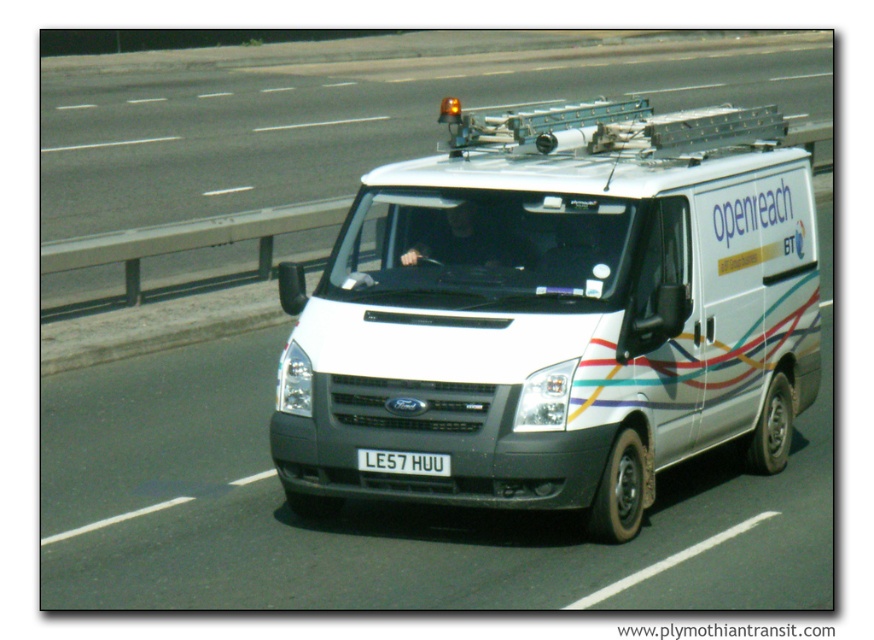
You are a driver looking at the white matte van at center and the white plastic license plate at center from the front. Which object is higher up in the image?

The white matte van at center is taller than the white plastic license plate at center, so the white matte van at center is higher up in the image.

You are a traffic officer observing a white van at center with a white plastic license plate at center. Which object is positioned more to the right?

The white plastic license plate at center is positioned more to the right than the white van at center.

Wait, there are two white vans at the center? That seems confusing. Let me check the objects again. The user provided two objects labeled as white matte van at center and white van at center. The description says the matte one is smaller. Hmm, maybe one is a reflection or a different perspective? The scene mentions a single van, so perhaps a duplicate entry. But I need to follow the rules strictly. The question must include both object labels exactly as given. The answer should reference the description. So

The white matte van at center is smaller in size compared to the white van at center.